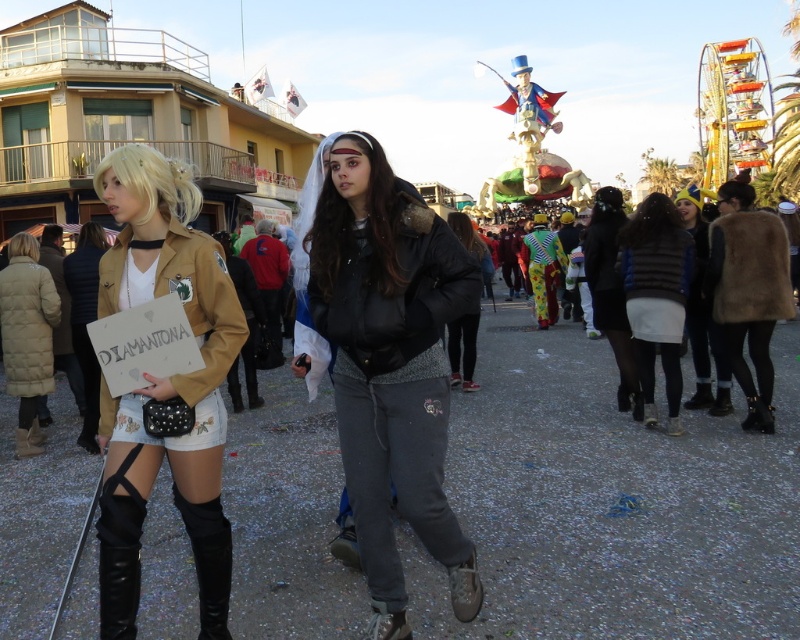
Question: Is matte black jacket at center to the left of matte brown jacket at center from the viewer's perspective?

Choices:
 (A) no
 (B) yes

Answer: (A)

Question: Where is matte brown jacket at center located in relation to black leather jacket at center in the image?

Choices:
 (A) right
 (B) left

Answer: (B)

Question: Which point is farther to the camera?

Choices:
 (A) black leather jacket at center
 (B) striped sweater at right

Answer: (B)

Question: Among these points, which one is nearest to the camera?

Choices:
 (A) (462, 316)
 (B) (630, 230)
 (C) (329, 196)

Answer: (C)

Question: Is matte brown jacket at center below black leather jacket at center?

Choices:
 (A) yes
 (B) no

Answer: (A)

Question: Which object is farther from the camera taking this photo?

Choices:
 (A) black leather jacket at center
 (B) striped sweater at right
 (C) matte black jacket at center
 (D) matte brown jacket at center

Answer: (B)